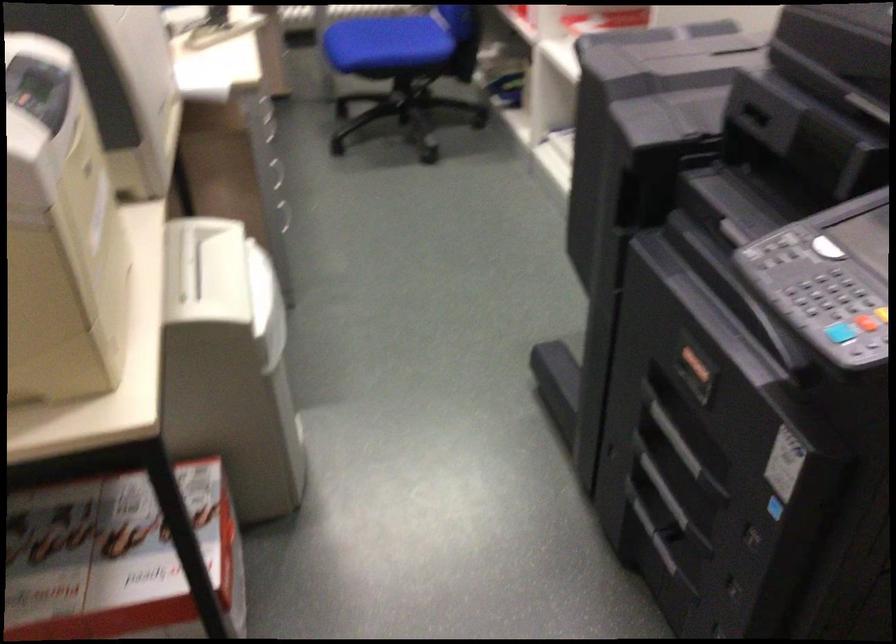
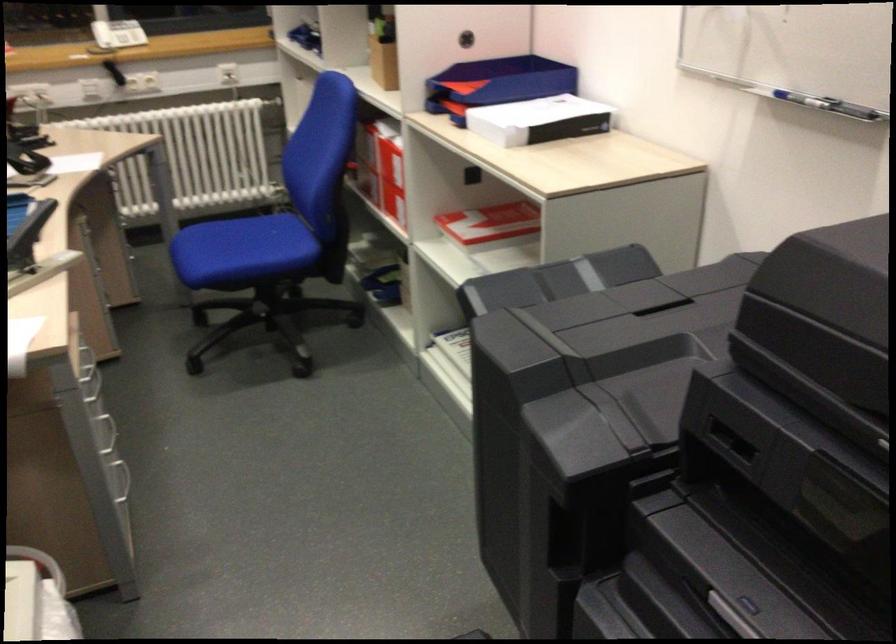
The point at [269,133] is marked in the first image. Where is the corresponding point in the second image?

(92, 386)